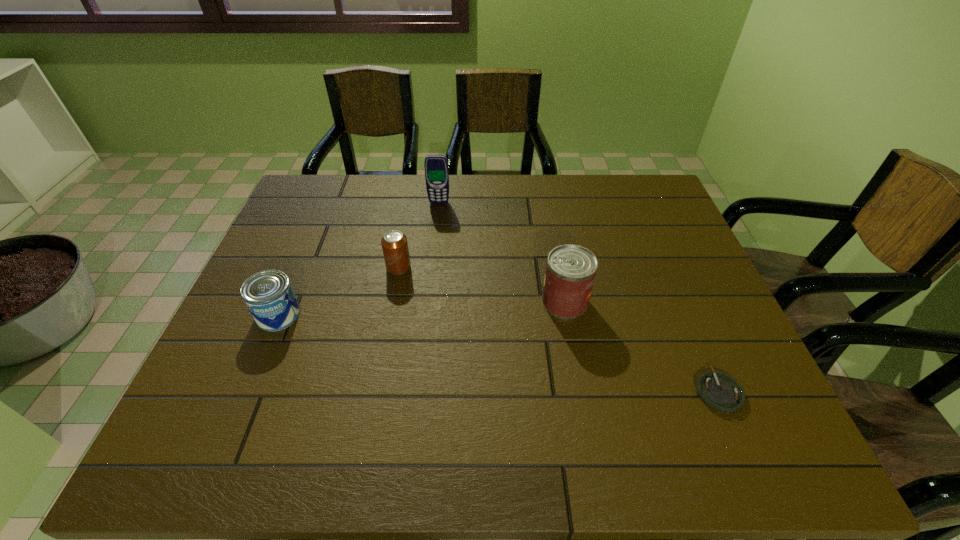
In order to click on free location located on the front of the tallest can in this screenshot , I will do `click(592, 453)`.

I want to click on vacant space situated on the left of the fourth nearest object, so click(x=313, y=267).

Find the location of a particular element. This screenshot has width=960, height=540. free location located 0.170m on the front label of the leftmost object is located at coordinates (244, 396).

Locate an element on the screen. The height and width of the screenshot is (540, 960). vacant point located 0.300m on the back of the ashtray is located at coordinates (668, 275).

Identify the location of object at the far edge. The image size is (960, 540). (436, 166).

Find the location of a particular element. This screenshot has height=540, width=960. object that is at the left edge is located at coordinates (268, 295).

Locate an element on the screen. object that is at the right edge is located at coordinates (719, 391).

This screenshot has width=960, height=540. Identify the location of vacant region at the far edge of the desktop. (608, 198).

This screenshot has width=960, height=540. What are the coordinates of `vacant space at the near edge of the desktop` in the screenshot? It's located at (356, 459).

Find the location of a particular element. free space at the far right corner of the desktop is located at coordinates (615, 205).